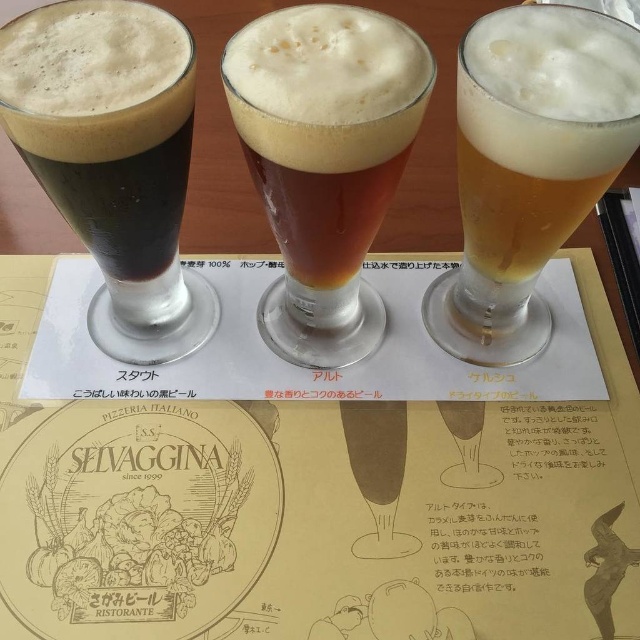
Question: Which object is positioned farthest from the golden frothy beer at right?

Choices:
 (A) amber glass beer at center
 (B) dark brown glass at left
 (C) matte paper menu at center

Answer: (B)

Question: Is matte paper menu at center positioned behind amber glass beer at center?

Choices:
 (A) yes
 (B) no

Answer: (A)

Question: Does matte paper menu at center have a lesser width compared to golden frothy beer at right?

Choices:
 (A) yes
 (B) no

Answer: (B)

Question: Which object appears closest to the camera in this image?

Choices:
 (A) golden frothy beer at right
 (B) amber glass beer at center
 (C) dark brown glass at left

Answer: (B)

Question: Among these points, which one is nearest to the camera?

Choices:
 (A) (490, 305)
 (B) (241, 83)

Answer: (B)

Question: Is amber glass beer at center in front of golden frothy beer at right?

Choices:
 (A) no
 (B) yes

Answer: (B)